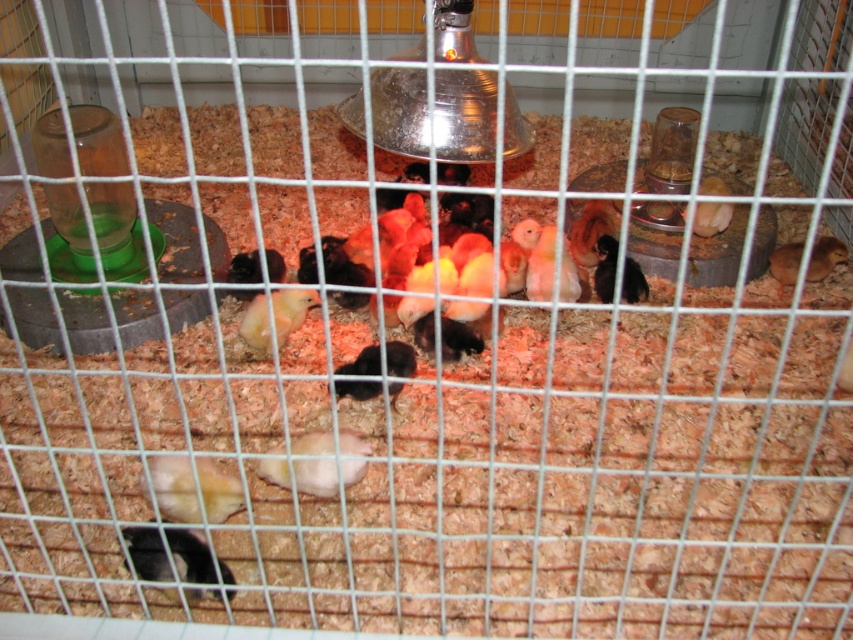
You are a farmer checking the chicks in the cage. You notice the black matte chick at center and the brown fluffy chick at upper right. Which chick is wider?

The black matte chick at center is wider than the brown fluffy chick at upper right.

You are a farmer checking on the chicks in the cage. You notice the yellow matte chick at center and the brown fuzzy chick at right. Which chick is closer to you from your viewing position?

The yellow matte chick at center is closer to you because it is positioned in front of the brown fuzzy chick at right.

You are a farmer checking the chicks in the cage. You need to locate the yellow matte chick at center. Where exactly is it positioned in the cage?

The yellow matte chick at center is located at point (289, 308) in the cage.